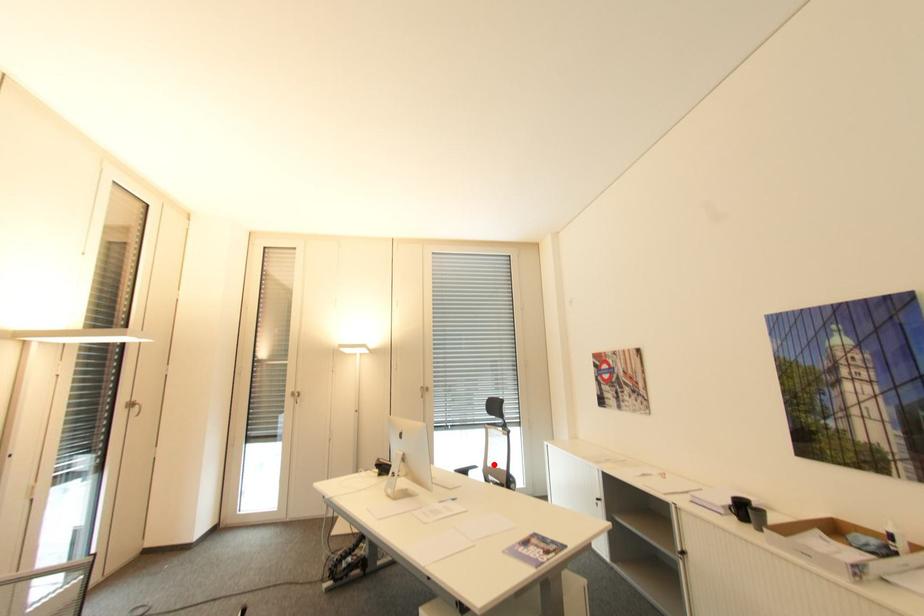
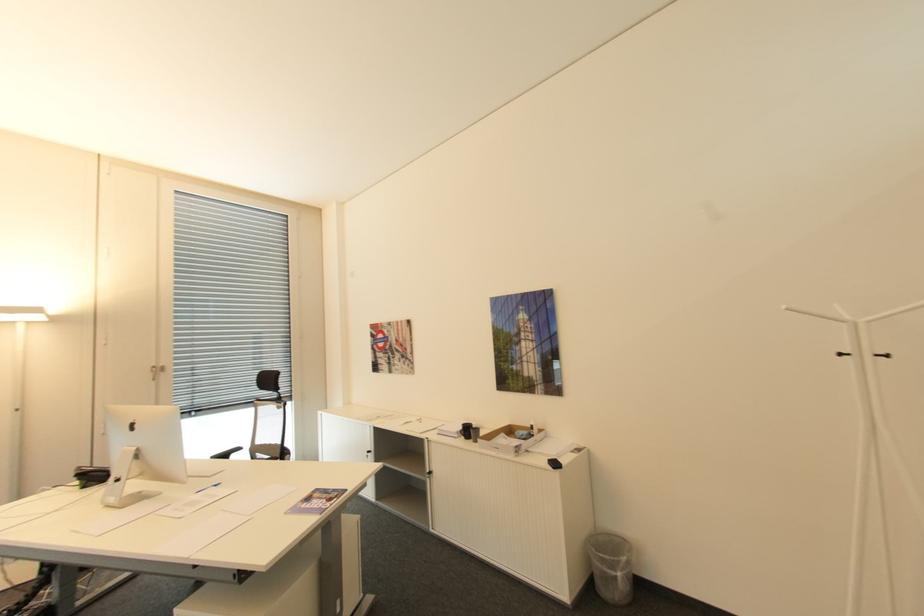
Locate, in the second image, the point that corresponds to the highlighted location in the first image.

(261, 442)